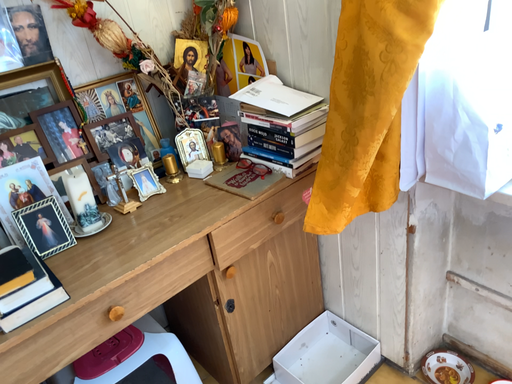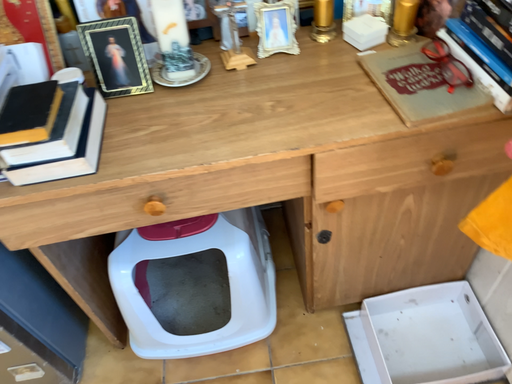
Question: How did the camera likely rotate when shooting the video?

Choices:
 (A) rotated left
 (B) rotated right

Answer: (A)